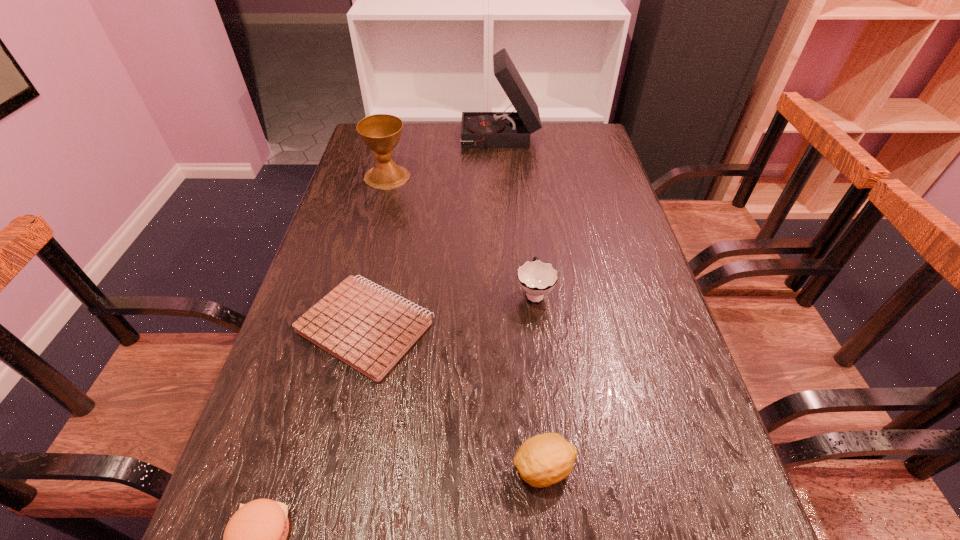
Identify the location of vacant space located 0.100m on the right of the fifth nearest object. 443,177.

This screenshot has height=540, width=960. Identify the location of free space located 0.290m on the side of the cup with the handle. (524, 202).

At what (x,y) coordinates should I click in order to perform the action: click on free location located on the side of the cup with the handle. Please return your answer as a coordinate pair (x, y). The image size is (960, 540). Looking at the image, I should click on (521, 180).

Where is `free spot located 0.330m on the side of the cup with the handle`? The width and height of the screenshot is (960, 540). free spot located 0.330m on the side of the cup with the handle is located at coordinates (523, 194).

The width and height of the screenshot is (960, 540). Find the location of `free space located 0.340m at the stem end of the second nearest object`. free space located 0.340m at the stem end of the second nearest object is located at coordinates (310, 468).

You are a GUI agent. You are given a task and a screenshot of the screen. Output one action in this format:
    pyautogui.click(x=<x>, y=<y>)
    Task: Click on the vacant space located at the stem end of the second nearest object
    
    Given the screenshot: What is the action you would take?
    pyautogui.click(x=405, y=468)

At what (x,y) coordinates should I click in order to perform the action: click on free region located at the stem end of the second nearest object. Please return your answer as a coordinate pair (x, y). Looking at the image, I should click on (340, 468).

Find the location of a particular element. The image size is (960, 540). vacant space located on the right of the shortest object is located at coordinates (611, 327).

This screenshot has width=960, height=540. Identify the location of object that is at the far edge. (504, 129).

Identify the location of chalice at the left edge. This screenshot has width=960, height=540. (381, 133).